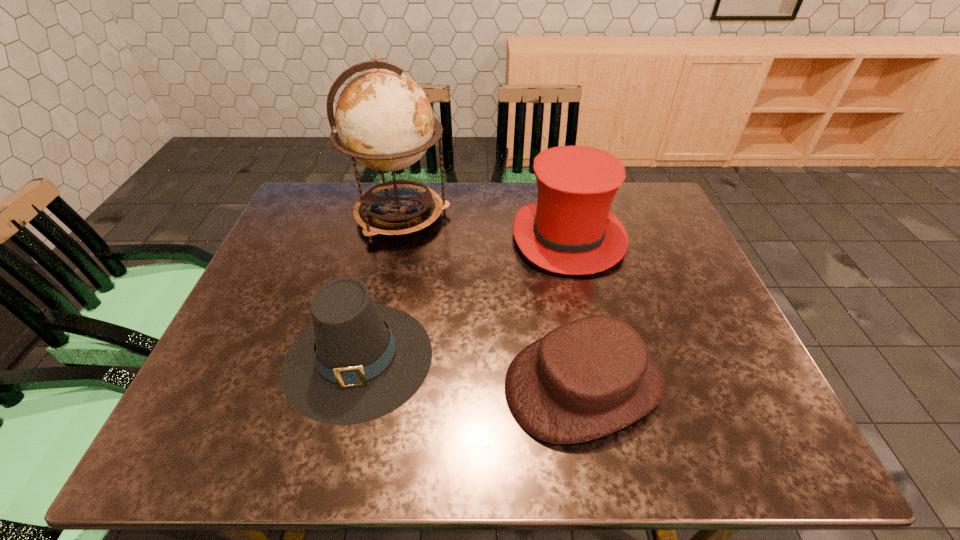
You are a GUI agent. You are given a task and a screenshot of the screen. Output one action in this format:
    pyautogui.click(x=<x>, y=<y>)
    Task: Click on the globe situated at the far edge
    This screenshot has width=960, height=540.
    Given the screenshot: What is the action you would take?
    pyautogui.click(x=385, y=121)

Locate an element on the screen. The width and height of the screenshot is (960, 540). hat present at the far edge is located at coordinates (x=570, y=230).

The height and width of the screenshot is (540, 960). What are the coordinates of `object present at the left edge` in the screenshot? It's located at (358, 361).

Identify the location of object that is positioned at the near left corner. (358, 361).

The image size is (960, 540). I want to click on free location at the far edge, so click(x=491, y=185).

Identify the location of vacant space at the left edge of the desktop. (263, 403).

In the image, there is a desktop. Where is `vacant region at the right edge`? The height and width of the screenshot is (540, 960). vacant region at the right edge is located at coordinates (685, 260).

You are a GUI agent. You are given a task and a screenshot of the screen. Output one action in this format:
    pyautogui.click(x=<x>, y=<y>)
    Task: Click on the vacant space at the far left corner of the desktop
    The image size is (960, 540).
    Given the screenshot: What is the action you would take?
    pyautogui.click(x=293, y=223)

At what (x,y) coordinates should I click in order to perform the action: click on free space at the far right corner of the desktop. Please return your answer as a coordinate pair (x, y). This screenshot has width=960, height=540. Looking at the image, I should click on (636, 221).

In the image, there is a desktop. Identify the location of vacant space at the near right corner. Image resolution: width=960 pixels, height=540 pixels. (756, 429).